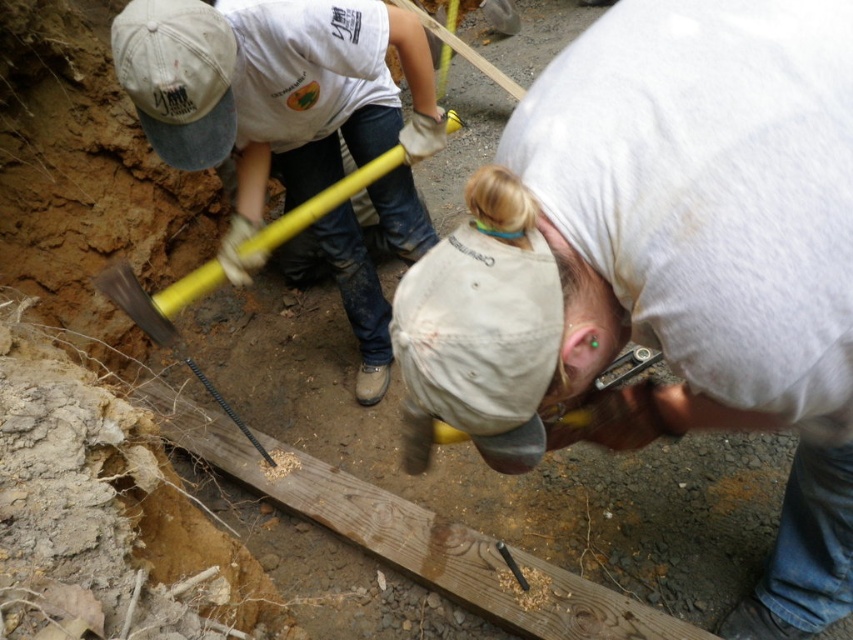
Is yellow rubber hammer at center thinner than yellow metal shovel at lower left?

No.

Between point (308, 81) and point (258, 442), which one is positioned behind?

The point (258, 442) is behind.

Image resolution: width=853 pixels, height=640 pixels. What do you see at coordinates (282, 100) in the screenshot? I see `yellow rubber hammer at center` at bounding box center [282, 100].

I want to click on yellow rubber hammer at center, so click(282, 100).